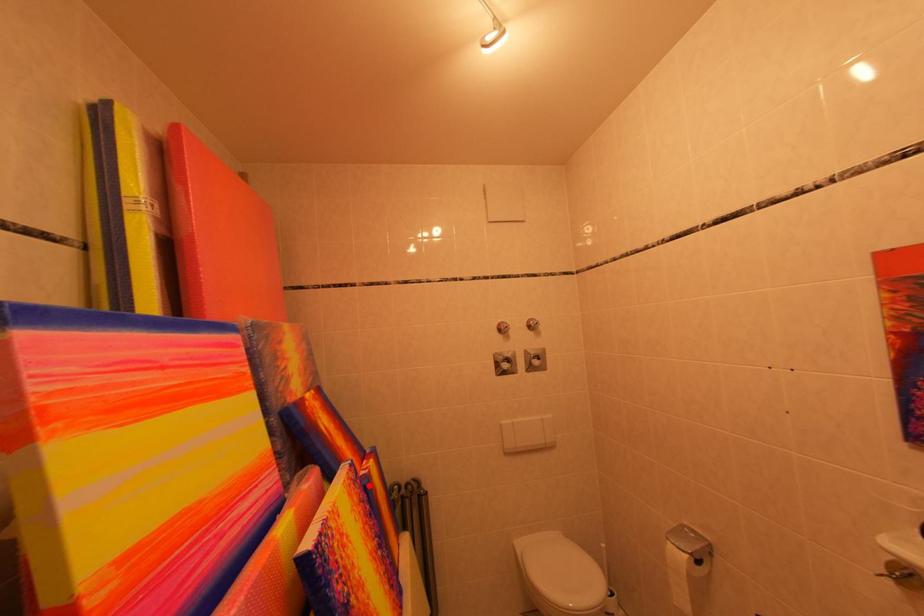
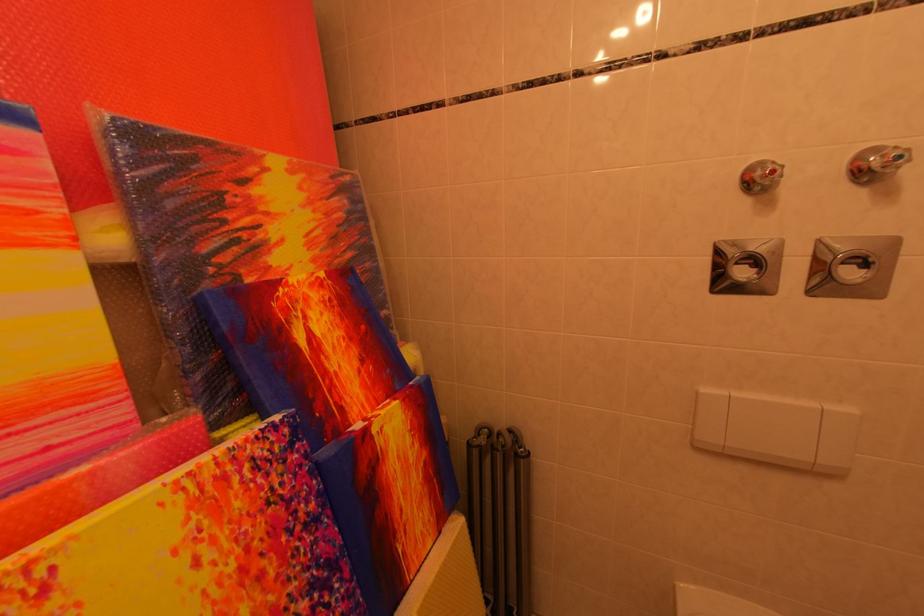
The point at the highlighted location is marked in the first image. Where is the corresponding point in the second image?

(313, 460)